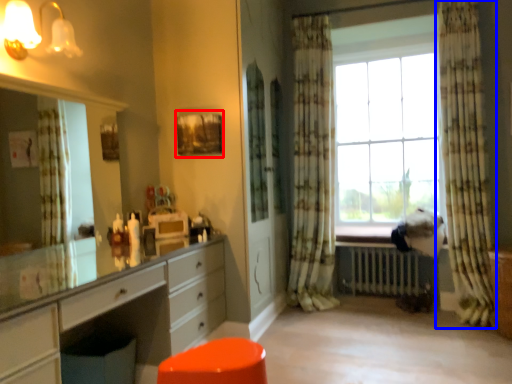
Question: Which object is further to the camera taking this photo, picture frame (highlighted by a red box) or curtain (highlighted by a blue box)?

Choices:
 (A) picture frame
 (B) curtain

Answer: (B)